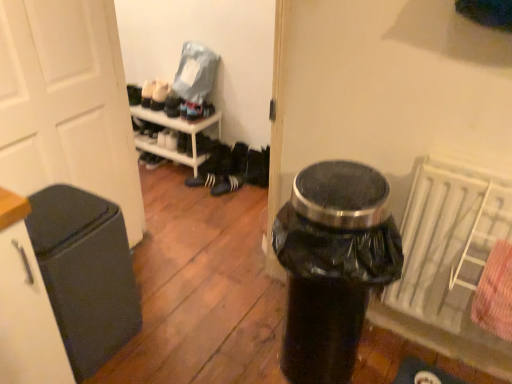
At what (x,y) coordinates should I click in order to perform the action: click on vacant location below black suede sneakers at center, the first footwear from the right (from a real-world perspective). Please return your answer as a coordinate pair (x, y). The height and width of the screenshot is (384, 512). Looking at the image, I should click on (217, 185).